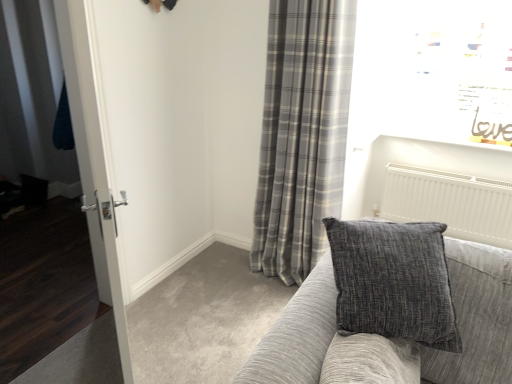
Question: Does textured gray couch at center have a lesser height compared to white glossy door at left?

Choices:
 (A) no
 (B) yes

Answer: (B)

Question: From a real-world perspective, is textured gray couch at center located beneath white glossy door at left?

Choices:
 (A) yes
 (B) no

Answer: (A)

Question: Does textured gray couch at center come in front of white glossy door at left?

Choices:
 (A) no
 (B) yes

Answer: (B)

Question: From the image's perspective, is textured gray couch at center under white glossy door at left?

Choices:
 (A) yes
 (B) no

Answer: (A)

Question: Could you tell me if textured gray couch at center is turned towards white glossy door at left?

Choices:
 (A) yes
 (B) no

Answer: (B)

Question: Does point (281, 57) appear closer or farther from the camera than point (459, 326)?

Choices:
 (A) farther
 (B) closer

Answer: (A)

Question: From the image's perspective, is gray plaid curtain at center above or below textured gray couch at center?

Choices:
 (A) above
 (B) below

Answer: (A)

Question: Based on their sizes in the image, would you say gray plaid curtain at center is bigger or smaller than textured gray couch at center?

Choices:
 (A) small
 (B) big

Answer: (A)

Question: Is gray plaid curtain at center taller or shorter than textured gray couch at center?

Choices:
 (A) tall
 (B) short

Answer: (A)

Question: Is gray plaid curtain at center spatially inside white glossy door at left, or outside of it?

Choices:
 (A) inside
 (B) outside

Answer: (B)

Question: In the image, is gray plaid curtain at center on the left side or the right side of white glossy door at left?

Choices:
 (A) left
 (B) right

Answer: (B)

Question: Relative to white glossy door at left, is gray plaid curtain at center in front or behind?

Choices:
 (A) behind
 (B) front

Answer: (A)

Question: Considering the positions of gray plaid curtain at center and white glossy door at left in the image, is gray plaid curtain at center taller or shorter than white glossy door at left?

Choices:
 (A) short
 (B) tall

Answer: (B)

Question: Would you say textured gray couch at center is inside or outside gray plaid curtain at center?

Choices:
 (A) outside
 (B) inside

Answer: (A)

Question: Considering the positions of point (336, 362) and point (284, 168), is point (336, 362) closer or farther from the camera than point (284, 168)?

Choices:
 (A) closer
 (B) farther

Answer: (A)